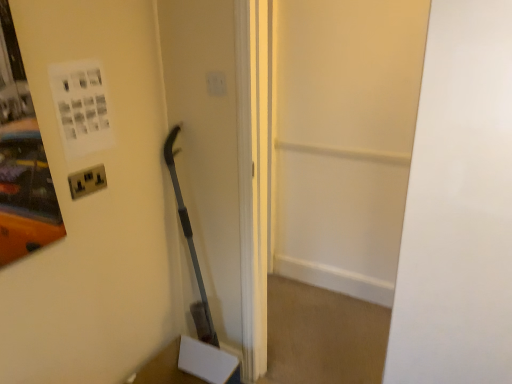
Question: From a real-world perspective, relative to transparent glass door at center, is white matte door at center vertically above or below?

Choices:
 (A) below
 (B) above

Answer: (B)

Question: From the image's perspective, is white matte door at center positioned above or below transparent glass door at center?

Choices:
 (A) below
 (B) above

Answer: (A)

Question: Based on their relative distances, which object is nearer to the white matte door at center?

Choices:
 (A) metallic socket at left
 (B) transparent glass door at center
 (C) white plastic light switch at upper center

Answer: (C)

Question: Estimate the real-world distances between objects in this image. Which object is closer to the white plastic light switch at upper center?

Choices:
 (A) white matte door at center
 (B) transparent glass door at center
 (C) metallic socket at left

Answer: (C)